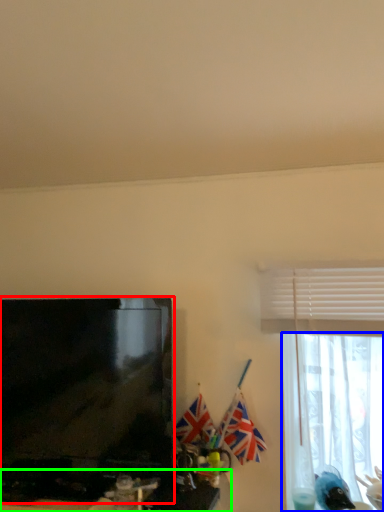
Question: Which is nearer to the television (highlighted by a red box)? curtain (highlighted by a blue box) or computer desk (highlighted by a green box).

Choices:
 (A) curtain
 (B) computer desk

Answer: (B)